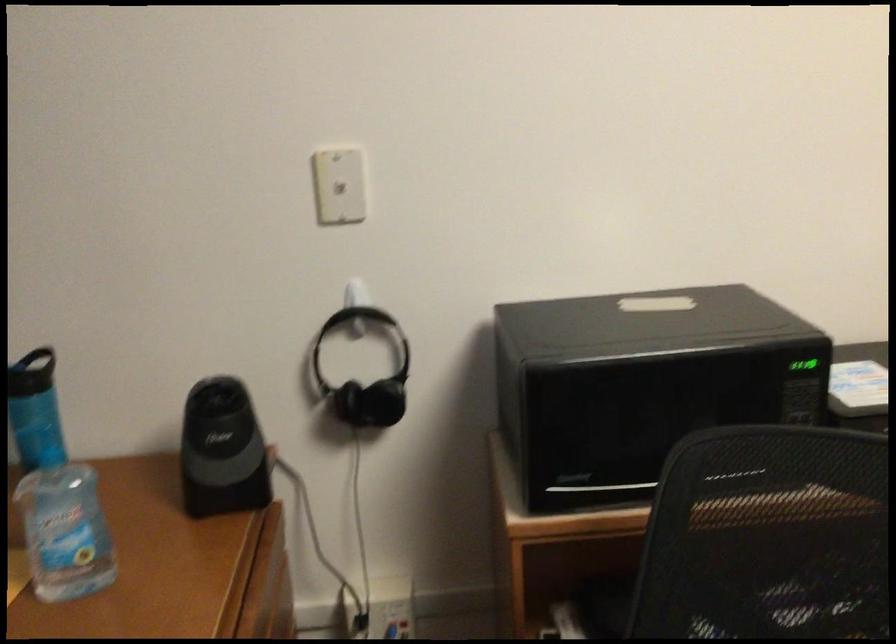
The width and height of the screenshot is (896, 644). Describe the element at coordinates (67, 556) in the screenshot. I see `the soap dispenser pump` at that location.